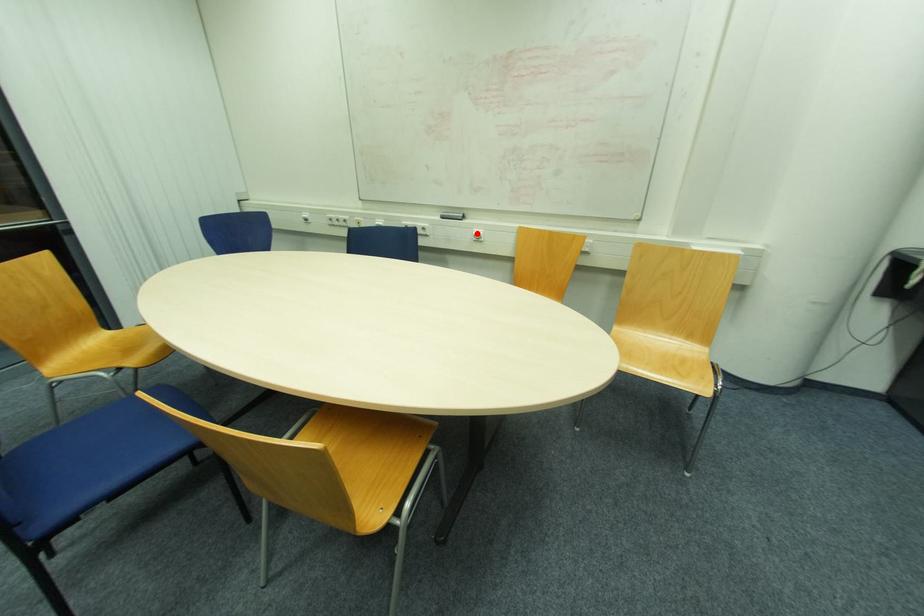
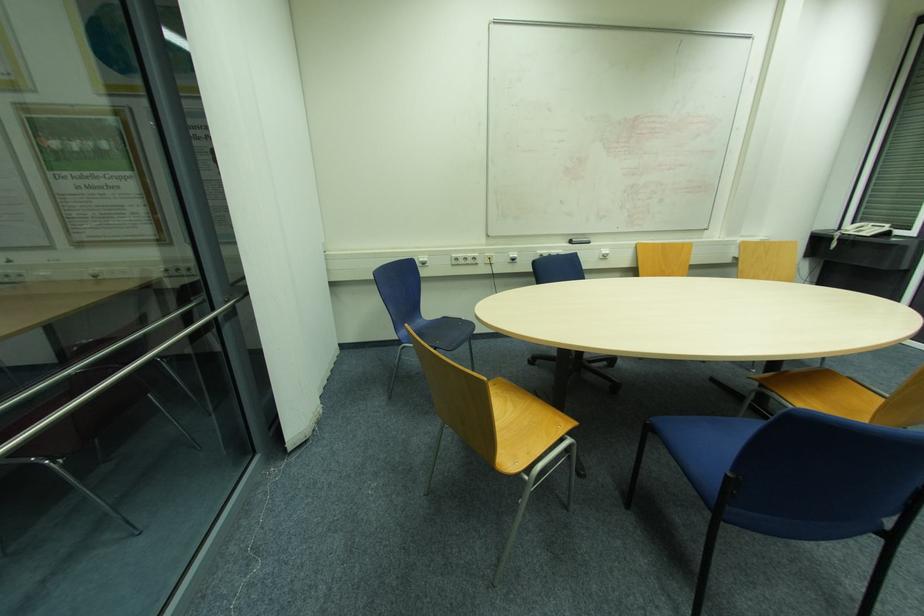
The point at the highlighted location is marked in the first image. Where is the corresponding point in the second image?

(604, 253)